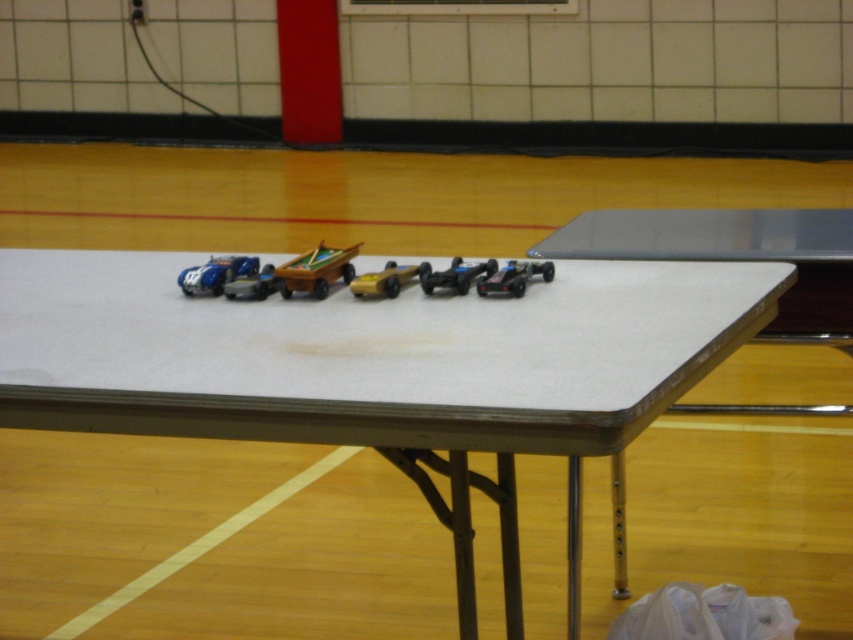
Is shiny blue plastic toy car at left bigger than black matte car at center?

Correct, shiny blue plastic toy car at left is larger in size than black matte car at center.

Locate an element on the screen. The height and width of the screenshot is (640, 853). shiny blue plastic toy car at left is located at coordinates (216, 273).

Does black plastic car at center appear on the left side of black matte car at center?

No, black plastic car at center is not to the left of black matte car at center.

Is black plastic car at center smaller than black matte car at center?

Yes.

Image resolution: width=853 pixels, height=640 pixels. I want to click on black plastic car at center, so click(514, 276).

Which is above, wooden toy car at center or gold metallic car at center?

Positioned higher is wooden toy car at center.

Does wooden toy car at center come behind gold metallic car at center?

Yes, wooden toy car at center is further from the viewer.

Who is more forward, [285,296] or [389,280]?

Point [389,280] is more forward.

Find the location of a particular element. The height and width of the screenshot is (640, 853). wooden toy car at center is located at coordinates (316, 269).